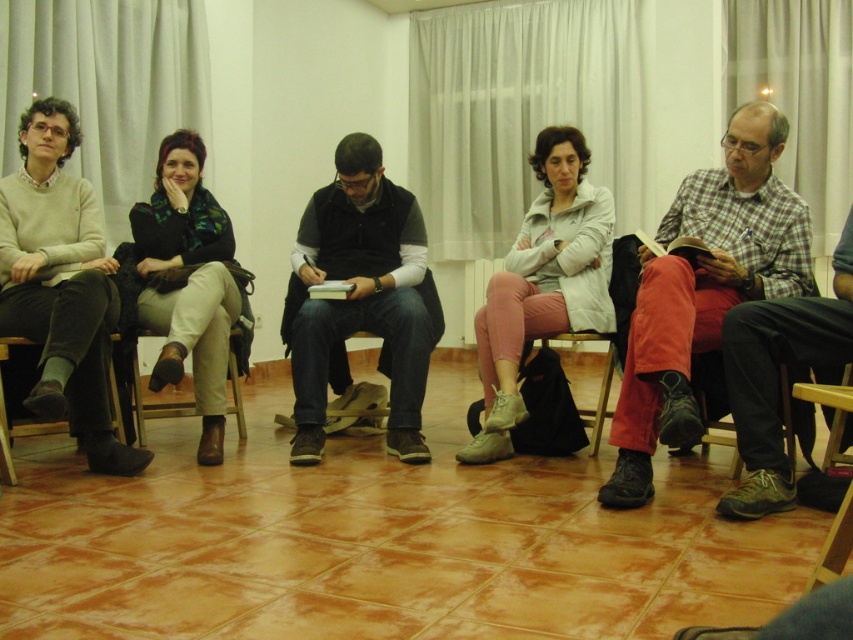
Which is behind, point (531, 276) or point (775, 310)?

Point (531, 276)

Does light pink fabric pants at center appear under plaid flannel shirt at right?

Incorrect, light pink fabric pants at center is not positioned below plaid flannel shirt at right.

At what (x,y) coordinates should I click in order to perform the action: click on light pink fabric pants at center. Please return your answer as a coordinate pair (x, y). The width and height of the screenshot is (853, 640). Looking at the image, I should click on (543, 284).

The height and width of the screenshot is (640, 853). In order to click on light pink fabric pants at center in this screenshot , I will do `click(543, 284)`.

Can you confirm if dark gray sweater at center is shorter than plaid flannel shirt at right?

Incorrect, dark gray sweater at center's height does not fall short of plaid flannel shirt at right's.

Find the location of `dark gray sweater at center`. dark gray sweater at center is located at coordinates (361, 298).

Is plaid fabric shirt at center wider than wooden chair at lower right?

Correct, the width of plaid fabric shirt at center exceeds that of wooden chair at lower right.

Measure the distance between point [662,364] and camera.

A distance of 7.98 feet exists between point [662,364] and camera.

Is point (749, 216) in front of point (842, 554)?

No, it is behind (842, 554).

Identify the location of plaid fabric shirt at center. (704, 289).